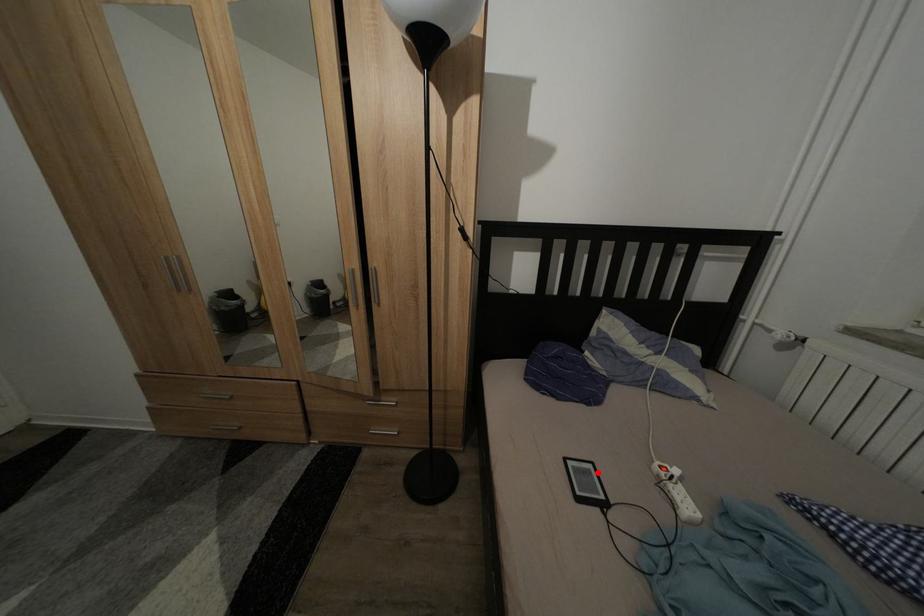
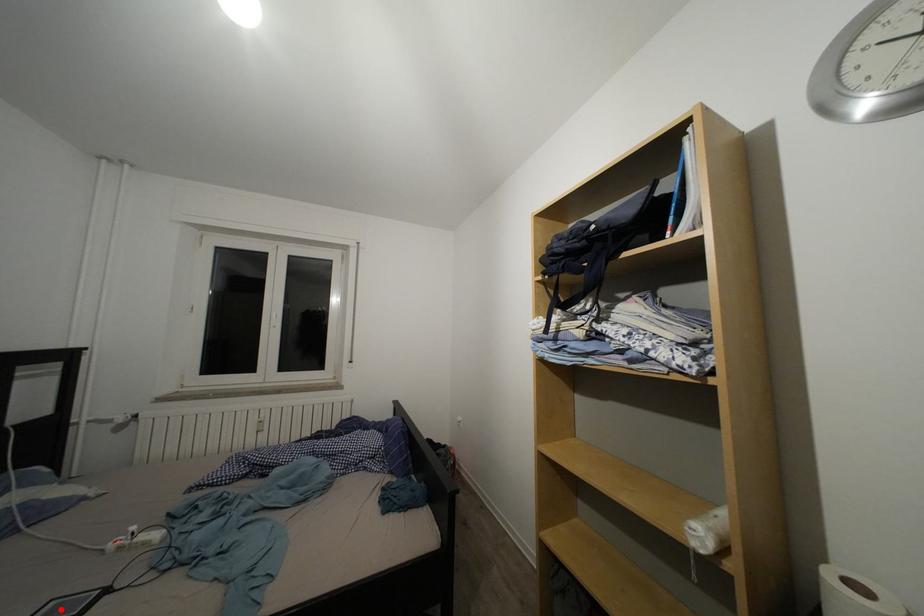
I am providing you with two images of the same scene from different viewpoints. A red point is marked on the first image and another point is marked on the second image. Is the marked point in image1 the same physical position as the marked point in image2?

Yes